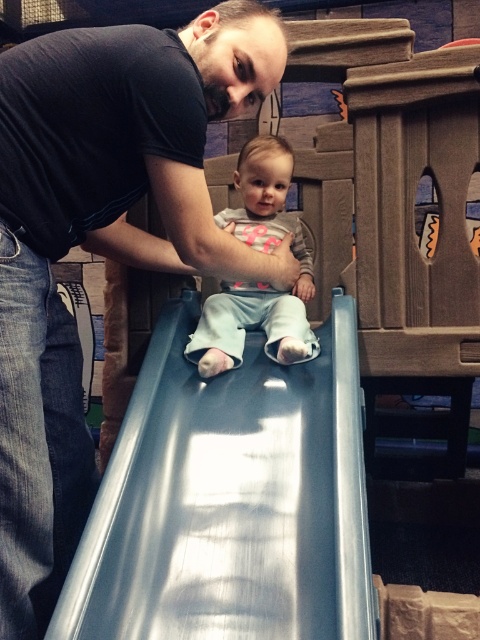
You are a photographer standing at the back of the play area. You want to take a photo of the black matte shirt at upper left and the metallic smooth slide at center. Which object should you focus on first if you want to capture both clearly in your shot?

The black matte shirt at upper left is much taller than the metallic smooth slide at center, so focusing on the taller object first would ensure both are in focus.

You are standing in the play area and want to place a small toy between the two points, point [39,442] and point [240,320]. Which point should the toy be closer to if you want it to be more visible to someone approaching from the front?

The toy should be placed closer to point [39,442] because it is closer to the viewer, making it more visible to someone approaching from the front.

You are a parent at a playground. You see the metallic smooth slide at center and the light blue fabric pants at center. Which object is positioned to the left?

The metallic smooth slide at center is positioned to the left of the light blue fabric pants at center.